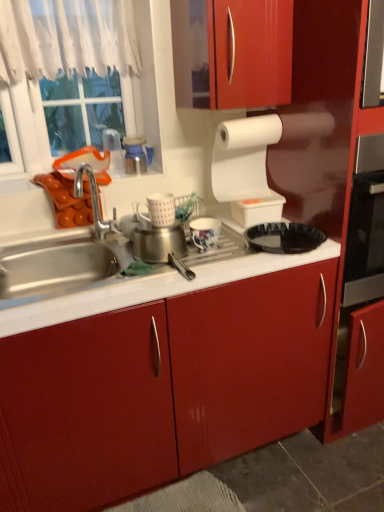
Question: Does black plastic tray at center appear on the right side of white plastic container at upper center, marked as the first appliance in a right-to-left arrangement?

Choices:
 (A) yes
 (B) no

Answer: (A)

Question: Is black plastic tray at center oriented away from white plastic container at upper center, positioned as the 4th appliance in left-to-right order?

Choices:
 (A) yes
 (B) no

Answer: (A)

Question: Does black plastic tray at center have a greater height compared to white plastic container at upper center, marked as the first appliance in a right-to-left arrangement?

Choices:
 (A) no
 (B) yes

Answer: (A)

Question: Is black plastic tray at center aimed at white plastic container at upper center, positioned as the 4th appliance in left-to-right order?

Choices:
 (A) yes
 (B) no

Answer: (B)

Question: Could white plastic container at upper center, marked as the first appliance in a right-to-left arrangement, be considered to be inside black plastic tray at center?

Choices:
 (A) no
 (B) yes

Answer: (A)

Question: Does point (9, 48) appear closer or farther from the camera than point (264, 230)?

Choices:
 (A) closer
 (B) farther

Answer: (B)

Question: In the image, is white sheer curtain at upper left on the left side or the right side of black plastic tray at center?

Choices:
 (A) left
 (B) right

Answer: (A)

Question: From the image's perspective, is white sheer curtain at upper left positioned above or below black plastic tray at center?

Choices:
 (A) below
 (B) above

Answer: (B)

Question: Looking at their shapes, would you say white sheer curtain at upper left is wider or thinner than black plastic tray at center?

Choices:
 (A) thin
 (B) wide

Answer: (A)

Question: From their relative heights in the image, would you say white plastic container at upper center, marked as the first appliance in a right-to-left arrangement, is taller or shorter than brushed metal canister at upper center, arranged as the fourth appliance when viewed from the right?

Choices:
 (A) short
 (B) tall

Answer: (A)

Question: Is white plastic container at upper center, positioned as the 4th appliance in left-to-right order, bigger or smaller than brushed metal canister at upper center, which ranks as the 1th appliance in left-to-right order?

Choices:
 (A) small
 (B) big

Answer: (B)

Question: From the image's perspective, relative to brushed metal canister at upper center, which ranks as the 1th appliance in left-to-right order, is white plastic container at upper center, marked as the first appliance in a right-to-left arrangement, above or below?

Choices:
 (A) below
 (B) above

Answer: (A)

Question: Do you think white plastic container at upper center, positioned as the 4th appliance in left-to-right order, is within brushed metal canister at upper center, arranged as the fourth appliance when viewed from the right, or outside of it?

Choices:
 (A) inside
 (B) outside

Answer: (B)

Question: Considering the positions of porcelain floral mug at center, the 2th appliance when ordered from right to left, and black plastic tray at center in the image, is porcelain floral mug at center, the 2th appliance when ordered from right to left, wider or thinner than black plastic tray at center?

Choices:
 (A) wide
 (B) thin

Answer: (B)

Question: Considering the relative positions of porcelain floral mug at center, the 2th appliance when ordered from right to left, and black plastic tray at center in the image provided, is porcelain floral mug at center, the 2th appliance when ordered from right to left, to the left or to the right of black plastic tray at center?

Choices:
 (A) right
 (B) left

Answer: (B)